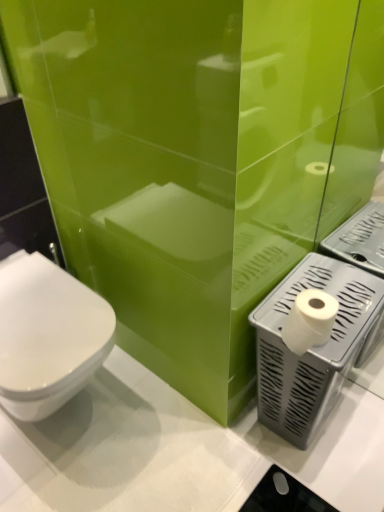
Question: Would you say white glossy toilet at left is to the left or to the right of white matte toilet paper at right in the picture?

Choices:
 (A) left
 (B) right

Answer: (A)

Question: From a real-world perspective, is white glossy toilet at left positioned above or below white matte toilet paper at right?

Choices:
 (A) above
 (B) below

Answer: (B)

Question: Based on their relative distances, which object is nearer to the gray plastic toilet paper holder at lower right?

Choices:
 (A) white glossy toilet at left
 (B) white matte toilet paper at right

Answer: (B)

Question: Based on their relative distances, which object is farther from the white matte toilet paper at right?

Choices:
 (A) white glossy toilet at left
 (B) gray plastic toilet paper holder at lower right

Answer: (A)